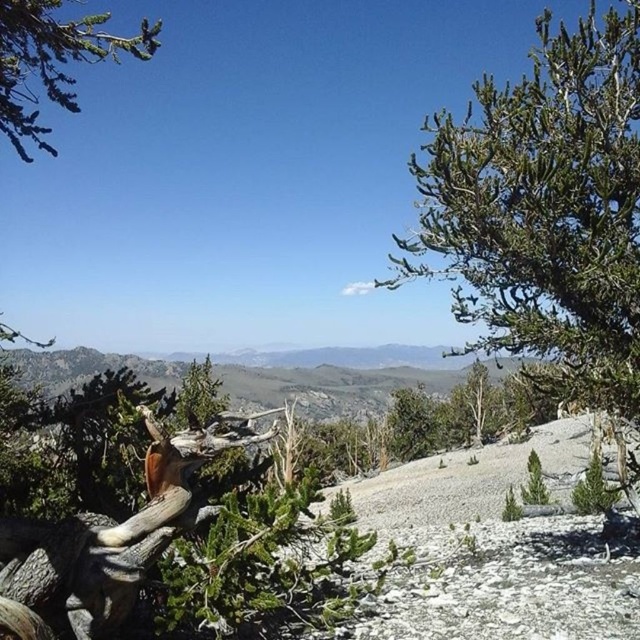
Question: Can you confirm if green needle-like at upper right is wider than green needle-like at upper left?

Choices:
 (A) no
 (B) yes

Answer: (A)

Question: Does green needle-like at upper right come behind green needle-like at upper left?

Choices:
 (A) no
 (B) yes

Answer: (A)

Question: Which of the following is the closest to the observer?

Choices:
 (A) green needle-like at upper left
 (B) green needle-like at upper right

Answer: (B)

Question: Which point is farther to the camera?

Choices:
 (A) green needle-like at upper right
 (B) green needle-like at upper left

Answer: (B)

Question: Which of the following is the closest to the observer?

Choices:
 (A) (499, 138)
 (B) (6, 93)

Answer: (B)

Question: Where is green needle-like at upper right located in relation to green needle-like at upper left in the image?

Choices:
 (A) left
 (B) right

Answer: (B)